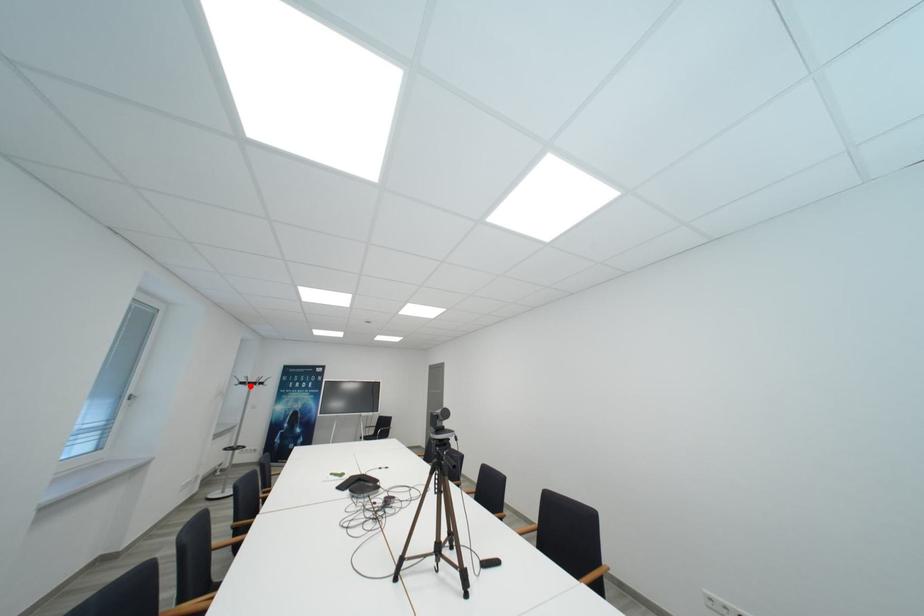
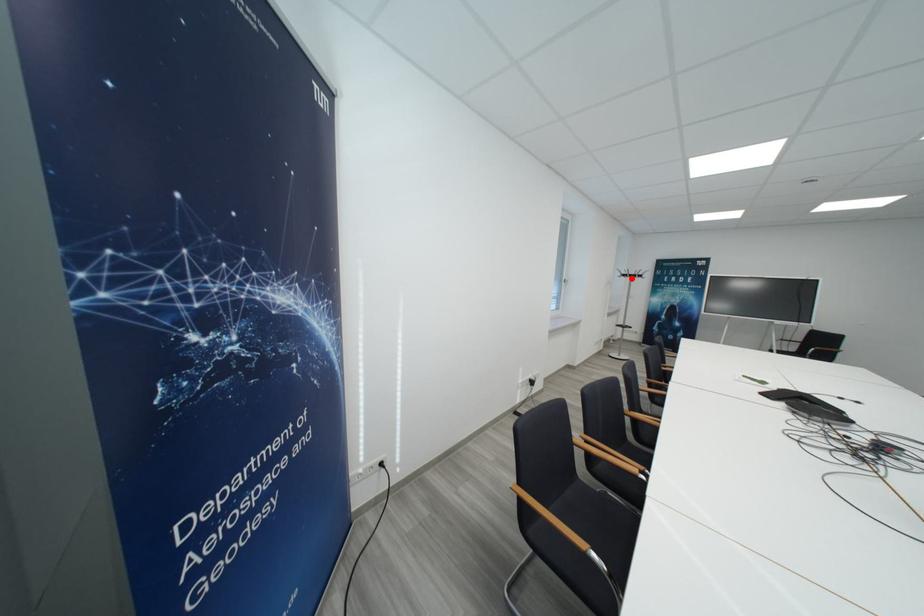
I am providing you with two images of the same scene from different viewpoints. A red point is marked on the first image and another point is marked on the second image. Is the marked point in image1 the same physical position as the marked point in image2?

Yes